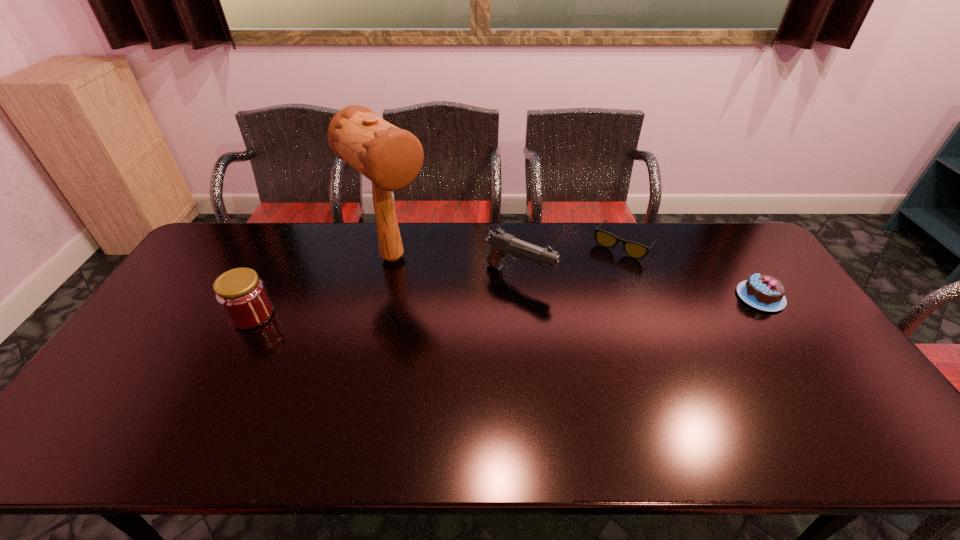
Where is `vacant spot on the desktop that is between the leftmost object and the chocolate cake and is positioned on the strike surface of the mallet`? The width and height of the screenshot is (960, 540). vacant spot on the desktop that is between the leftmost object and the chocolate cake and is positioned on the strike surface of the mallet is located at coordinates (450, 308).

At what (x,y) coordinates should I click in order to perform the action: click on free space on the desktop that is between the jam and the chocolate cake and is positioned in the direction the gun is aimed. Please return your answer as a coordinate pair (x, y). Looking at the image, I should click on (585, 303).

At what (x,y) coordinates should I click in order to perform the action: click on vacant spot on the desktop that is between the jam and the rightmost object and is positioned on the front-facing side of the shortest object. Please return your answer as a coordinate pair (x, y). The image size is (960, 540). Looking at the image, I should click on (579, 303).